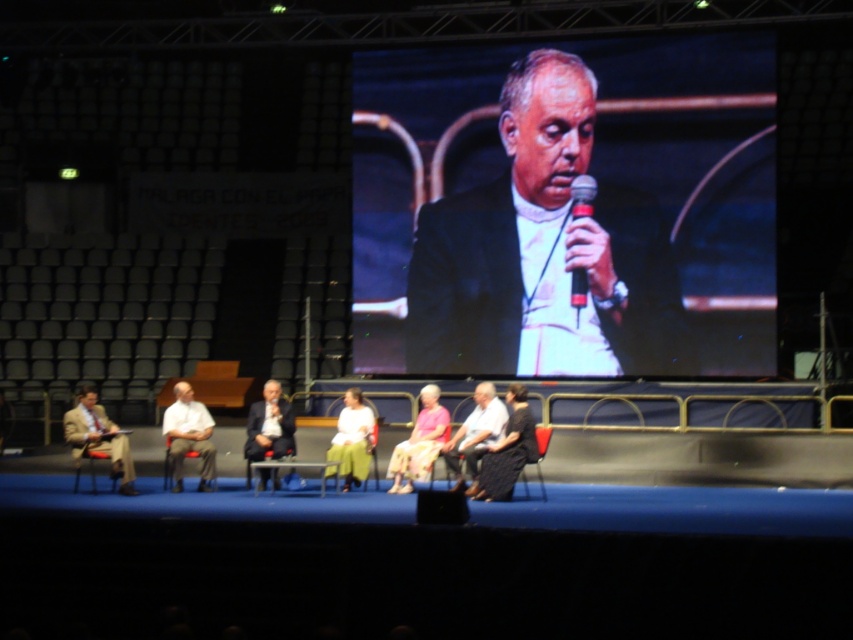
What is the 2D coordinate of the black textured dress at lower center?

The black textured dress at lower center is located at the 2D coordinate point of (508, 451).